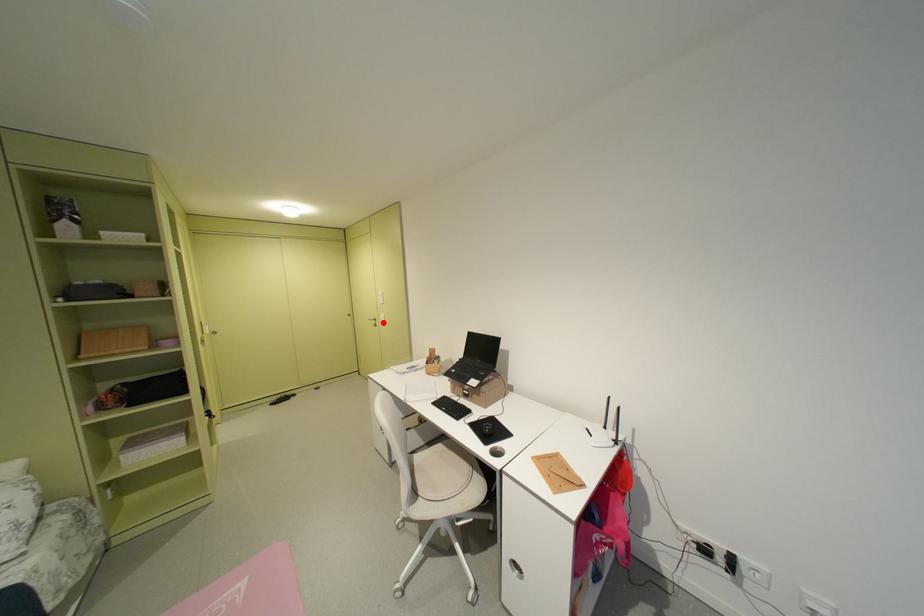
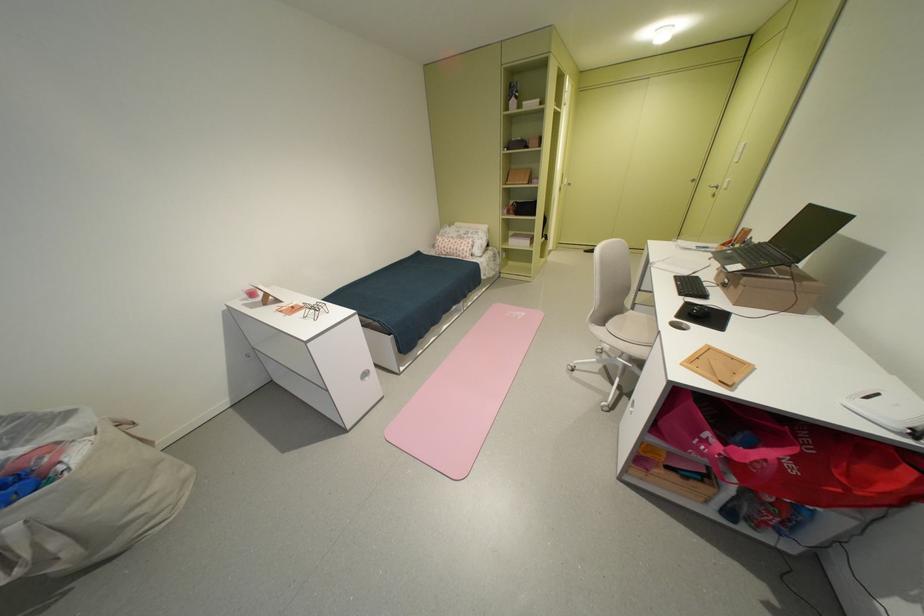
Find the pixel in the second image that matches the highlighted location in the first image.

(724, 190)